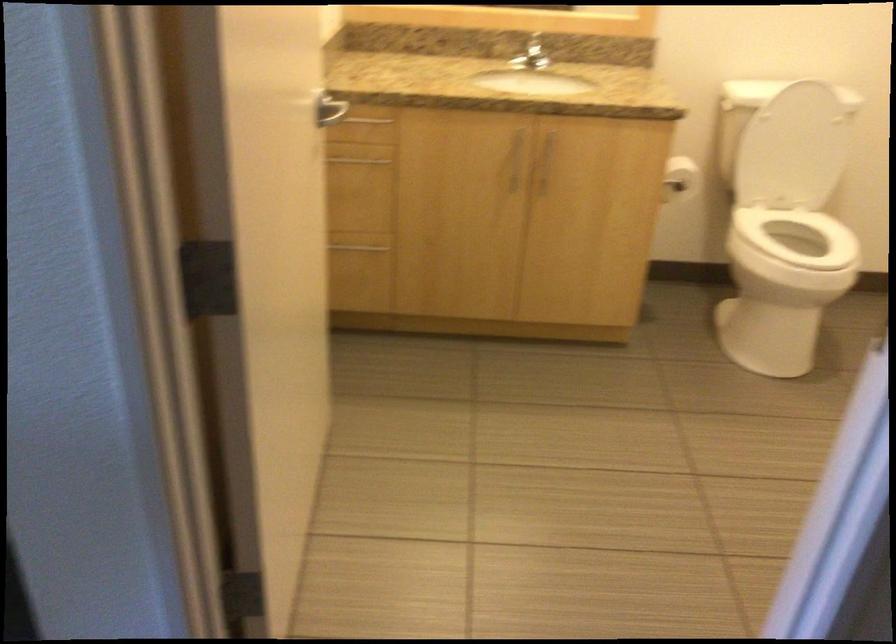
Locate an element on the screen. The image size is (896, 644). toilet lid is located at coordinates (793, 149).